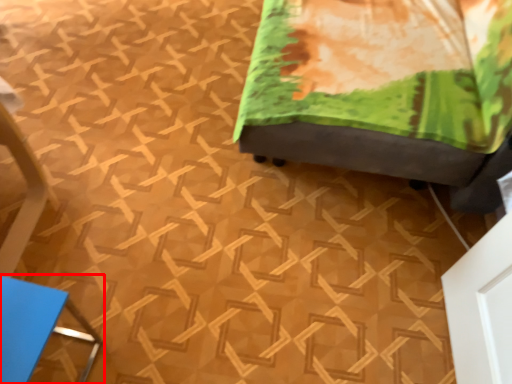
Question: From the image's perspective, where is furniture (annotated by the red box) located in relation to furniture in the image?

Choices:
 (A) below
 (B) above

Answer: (A)